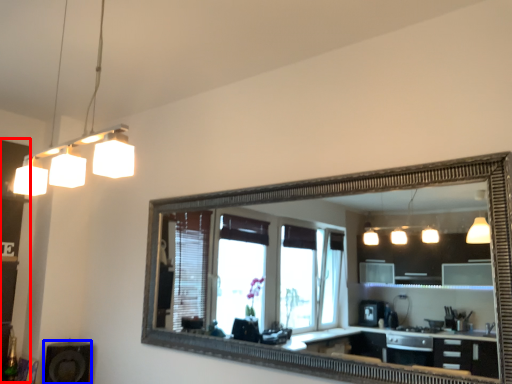
Question: Which point is closer to the camera, dresser (highlighted by a red box) or speaker (highlighted by a blue box)?

Choices:
 (A) dresser
 (B) speaker

Answer: (A)